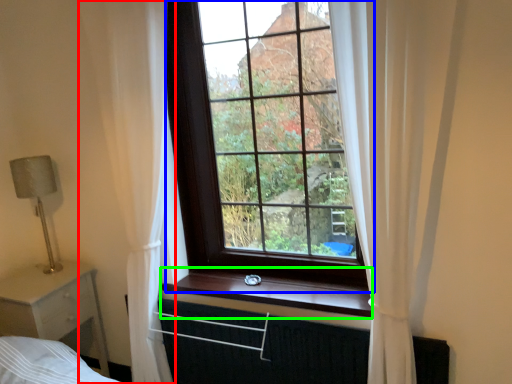
Question: Which object is positioned closest to curtain (highlighted by a red box)? Select from window (highlighted by a blue box) and window sill (highlighted by a green box).

Choices:
 (A) window
 (B) window sill

Answer: (A)